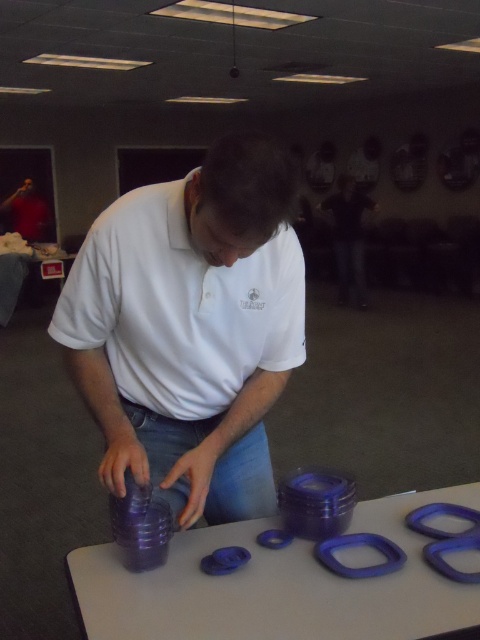
Question: Can you confirm if white matte shirt at center is smaller than matte white shirt at center?

Choices:
 (A) yes
 (B) no

Answer: (A)

Question: Is white matte shirt at center wider than matte white shirt at center?

Choices:
 (A) yes
 (B) no

Answer: (B)

Question: Which of the following is the farthest from the observer?

Choices:
 (A) (83, 595)
 (B) (240, 458)
 (C) (346, 221)

Answer: (C)

Question: Which point is farther from the camera taking this photo?

Choices:
 (A) (260, 564)
 (B) (225, 513)

Answer: (B)

Question: Which is farther from the purple plastic rings at center?

Choices:
 (A) white matte shirt at center
 (B) matte white shirt at center

Answer: (B)

Question: Does purple plastic rings at center appear on the left side of matte white shirt at center?

Choices:
 (A) no
 (B) yes

Answer: (B)